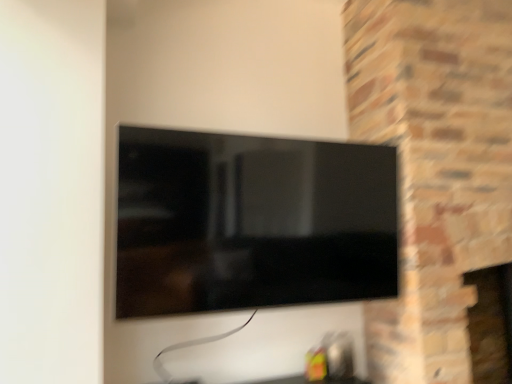
Locate an element on the screen. Image resolution: width=512 pixels, height=384 pixels. matte black tv at center is located at coordinates (251, 222).

What is the approximate height of matte black tv at center?

Result: The height of matte black tv at center is 26.54 inches.

What do you see at coordinates (251, 222) in the screenshot?
I see `matte black tv at center` at bounding box center [251, 222].

At what (x,y) coordinates should I click in order to perform the action: click on matte black tv at center. Please return your answer as a coordinate pair (x, y). Looking at the image, I should click on (251, 222).